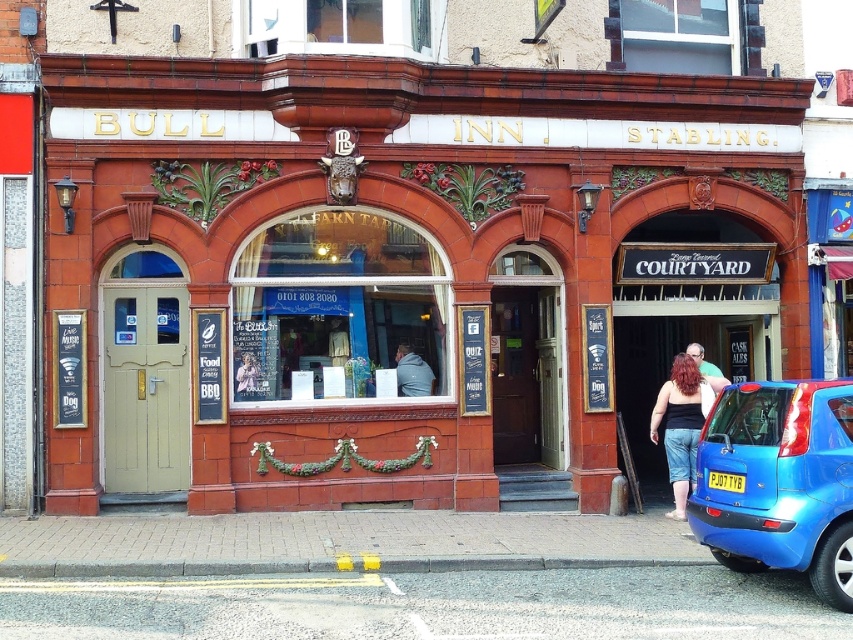
Between red brick building at center and blue glossy hatchback at lower right, which one appears on the left side from the viewer's perspective?

red brick building at center is more to the left.

Consider the image. Is red brick building at center below blue glossy hatchback at lower right?

No.

The height and width of the screenshot is (640, 853). Identify the location of red brick building at center. (387, 260).

At what (x,y) coordinates should I click in order to perform the action: click on red brick building at center. Please return your answer as a coordinate pair (x, y). This screenshot has width=853, height=640. Looking at the image, I should click on (387, 260).

Who is lower down, matte black tank top at center or dark gray hoodie at center?

matte black tank top at center

Does matte black tank top at center have a lesser width compared to dark gray hoodie at center?

No.

Who is more distant from viewer, (682, 518) or (422, 365)?

Positioned behind is point (422, 365).

What are the coordinates of `matte black tank top at center` in the screenshot? It's located at (682, 422).

Looking at this image, is the position of yellow plastic license plate at lower center more distant than that of matte black hair at center?

No.

Looking at this image, which is more to the left, yellow plastic license plate at lower center or matte black hair at center?

From the viewer's perspective, yellow plastic license plate at lower center appears more on the left side.

Which is in front, point (744, 480) or point (711, 374)?

Point (744, 480)

Locate an element on the screen. Image resolution: width=853 pixels, height=640 pixels. yellow plastic license plate at lower center is located at coordinates (726, 481).